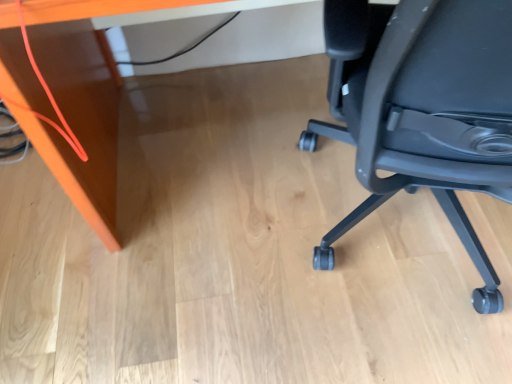
Where is `free space underneath black plastic chair at right (from a real-world perspective)`? The height and width of the screenshot is (384, 512). free space underneath black plastic chair at right (from a real-world perspective) is located at coordinates coord(404,253).